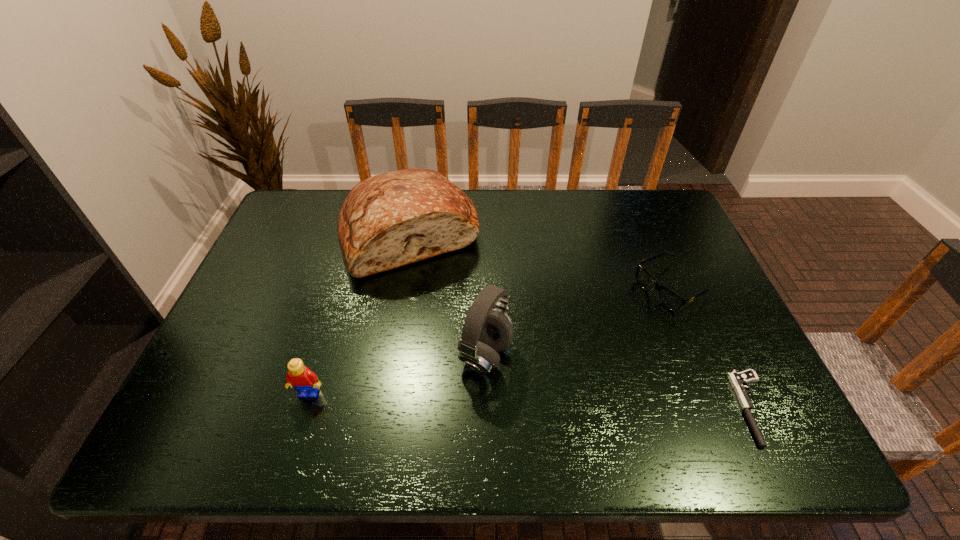
At what (x,y) coordinates should I click in order to perform the action: click on the third shortest object. Please return your answer as a coordinate pair (x, y). The height and width of the screenshot is (540, 960). Looking at the image, I should click on (299, 377).

The height and width of the screenshot is (540, 960). What are the coordinates of `pistol` in the screenshot? It's located at pos(738,380).

Identify the location of bread. The width and height of the screenshot is (960, 540). (389, 220).

At what (x,y) coordinates should I click in order to perform the action: click on sunglasses. Please return your answer as a coordinate pair (x, y). Looking at the image, I should click on (669, 299).

You are a GUI agent. You are given a task and a screenshot of the screen. Output one action in this format:
    pyautogui.click(x=<x>, y=<y>)
    Task: Click on the headset
    The image size is (960, 540).
    Given the screenshot: What is the action you would take?
    pyautogui.click(x=485, y=332)

At what (x,y) coordinates should I click in order to perform the action: click on free region located at the sliced front of the bread. Please return your answer as a coordinate pair (x, y). The width and height of the screenshot is (960, 540). Looking at the image, I should click on (462, 380).

Locate an element on the screen. Image resolution: width=960 pixels, height=540 pixels. vacant space located 0.120m at the sliced front of the bread is located at coordinates (438, 313).

Identify the location of free space located 0.300m at the sliced front of the bread. (458, 369).

Find the location of a particular element. The height and width of the screenshot is (540, 960). free space located on the front-facing side of the fourth tallest object is located at coordinates (540, 361).

You are a GUI agent. You are given a task and a screenshot of the screen. Output one action in this format:
    pyautogui.click(x=<x>, y=<y>)
    Task: Click on the free space located on the front-facing side of the fourth tallest object
    The width and height of the screenshot is (960, 540).
    Given the screenshot: What is the action you would take?
    pyautogui.click(x=554, y=353)